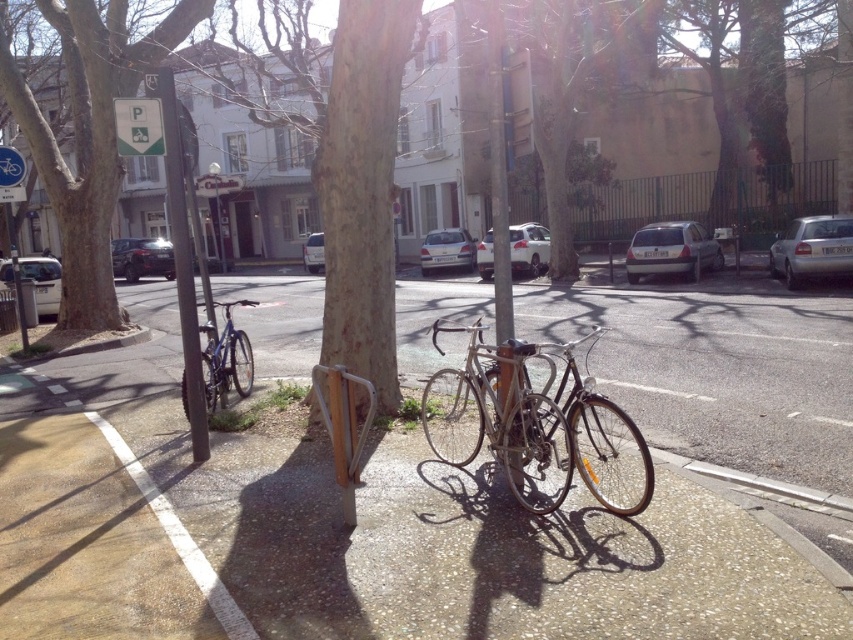
Who is shorter, concrete pavement at center or white glossy lamp post at upper center?

Standing shorter between the two is concrete pavement at center.

Does concrete pavement at center lie behind white glossy lamp post at upper center?

That is False.

Is point (561, 323) positioned after point (212, 161)?

No, (561, 323) is in front of (212, 161).

Where is `concrete pavement at center`? Image resolution: width=853 pixels, height=640 pixels. concrete pavement at center is located at coordinates (352, 531).

Looking at this image, who is taller, brown rough tree at upper left or green plastic parking sign at upper left?

With more height is brown rough tree at upper left.

Between brown rough tree at upper left and green plastic parking sign at upper left, which one appears on the left side from the viewer's perspective?

From the viewer's perspective, brown rough tree at upper left appears more on the left side.

Describe the element at coordinates (90, 134) in the screenshot. I see `brown rough tree at upper left` at that location.

At what (x,y) coordinates should I click in order to perform the action: click on brown rough tree at upper left. Please return your answer as a coordinate pair (x, y). This screenshot has width=853, height=640. Looking at the image, I should click on (90, 134).

Is the position of smooth brown tree trunk at center less distant than that of brown rough tree at upper left?

Yes, smooth brown tree trunk at center is in front of brown rough tree at upper left.

Who is positioned more to the left, smooth brown tree trunk at center or brown rough tree at upper left?

brown rough tree at upper left

The height and width of the screenshot is (640, 853). Find the location of `smooth brown tree trunk at center`. smooth brown tree trunk at center is located at coordinates (363, 188).